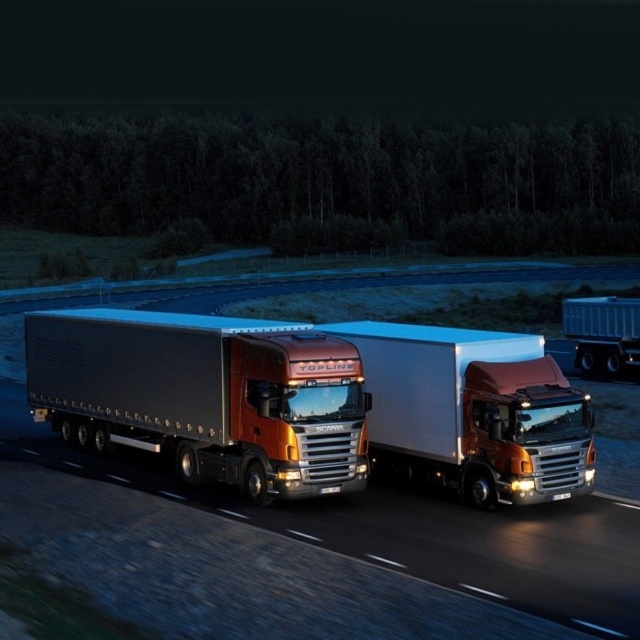
You are a delivery driver planning to pass under a low bridge that has a height restriction of 4 meters. You observe the metallic silver trailer truck at center and the metallic silver trailer at right on the road. Which vehicle should you choose to ensure safe passage under the bridge?

The metallic silver trailer at right is shorter in height compared to the metallic silver trailer truck at center, so choosing the metallic silver trailer at right would allow safe passage under the 4 meter height restriction bridge.

Based on the photo, you are a photographer wanting to capture both the metallic silver trailer truck at center and the white glossy truck at center in a single shot. Since you can only focus on one truck at a time, which truck should you focus on to ensure the other remains in the background?

The metallic silver trailer truck at center is positioned under the white glossy truck at center, so focusing on the white glossy truck at center will keep the metallic silver trailer truck at center in the background.

You are a delivery driver who needs to park your metallic silver trailer truck at center precisely at the coordinates given. What are the coordinates where you should position your truck?

The metallic silver trailer truck at center should be positioned at coordinates point (205, 396).